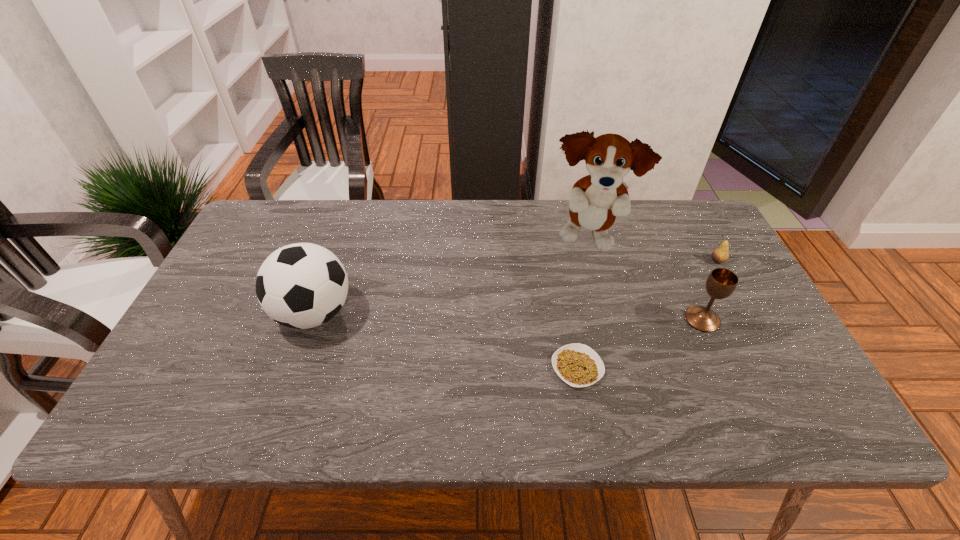
This screenshot has width=960, height=540. Find the location of `vacant area between the tallest object and the second tallest object`. vacant area between the tallest object and the second tallest object is located at coordinates (451, 277).

Locate an element on the screen. The image size is (960, 540). the closest object relative to the second object from right to left is located at coordinates (720, 254).

Identify which object is the third closest to the tallest object. Please provide its 2D coordinates. Your answer should be formatted as a tuple, i.e. [(x, y)], where the tuple contains the x and y coordinates of a point satisfying the conditions above.

[(578, 365)]

Identify the location of vacant space that satisfies the following two spatial constraints: 1. on the face of the puppy; 2. on the left side of the rightmost object. This screenshot has height=540, width=960. (593, 261).

Where is `vacant space that satisfies the following two spatial constraints: 1. on the face of the pear; 2. on the right side of the tallest object`? Image resolution: width=960 pixels, height=540 pixels. vacant space that satisfies the following two spatial constraints: 1. on the face of the pear; 2. on the right side of the tallest object is located at coordinates (593, 261).

Locate an element on the screen. This screenshot has height=540, width=960. vacant space that satisfies the following two spatial constraints: 1. on the face of the puppy; 2. on the left side of the chalice is located at coordinates (609, 319).